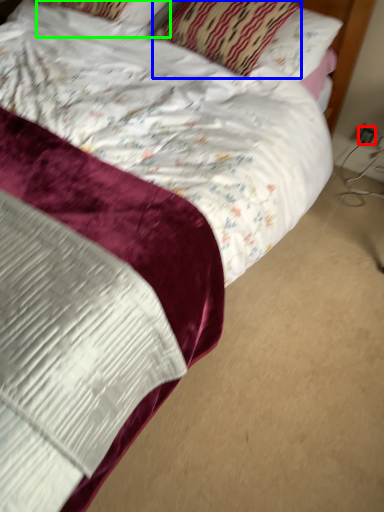
Question: Which is nearer to the electric outlet (highlighted by a red box)? pillow (highlighted by a blue box) or pillow (highlighted by a green box).

Choices:
 (A) pillow
 (B) pillow

Answer: (A)